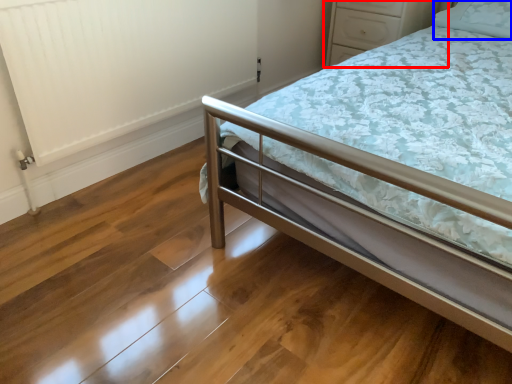
Question: Which point is closer to the camera, dresser (highlighted by a red box) or pillow (highlighted by a blue box)?

Choices:
 (A) dresser
 (B) pillow

Answer: (B)